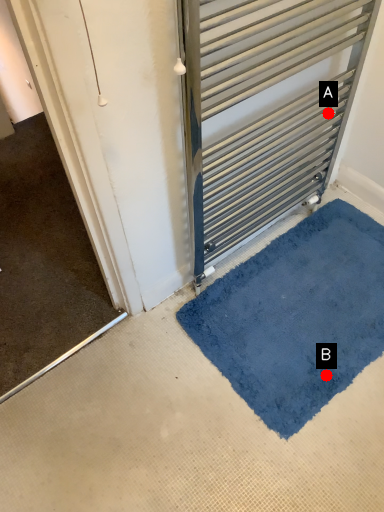
Question: Two points are circled on the image, labeled by A and B beside each circle. Which point appears closest to the camera in this image?

Choices:
 (A) A is closer
 (B) B is closer

Answer: (B)